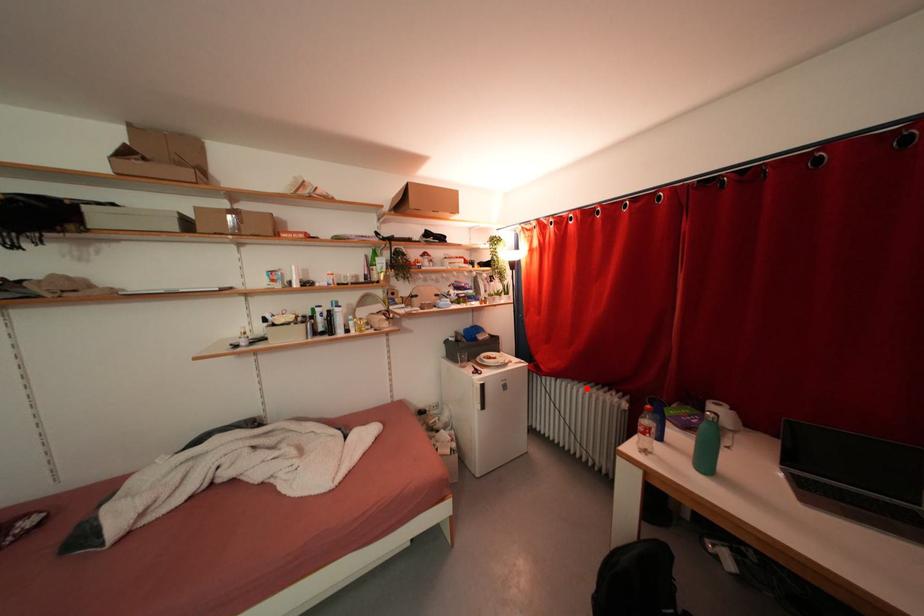
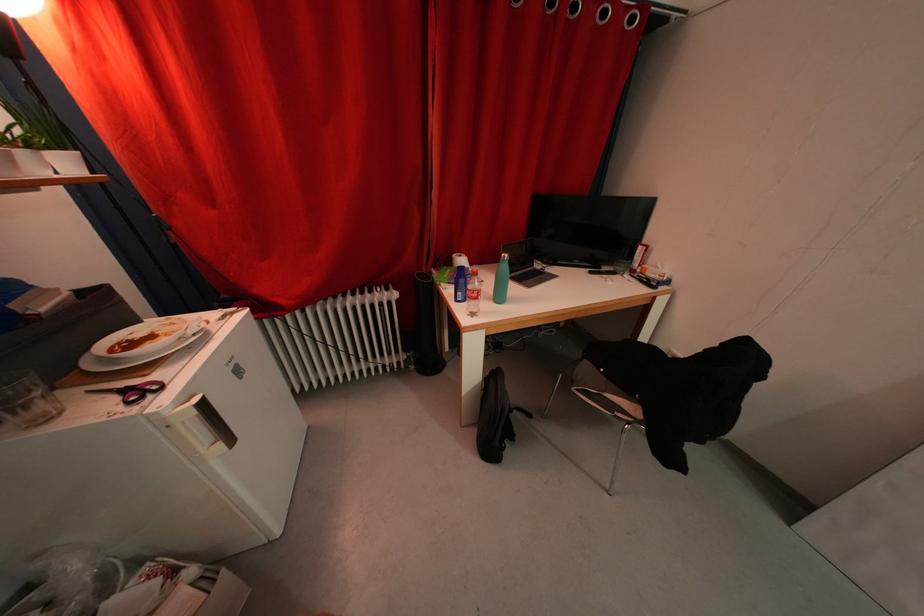
Where in the second image is the point corresponding to the highlighted location from the first image?

(346, 302)